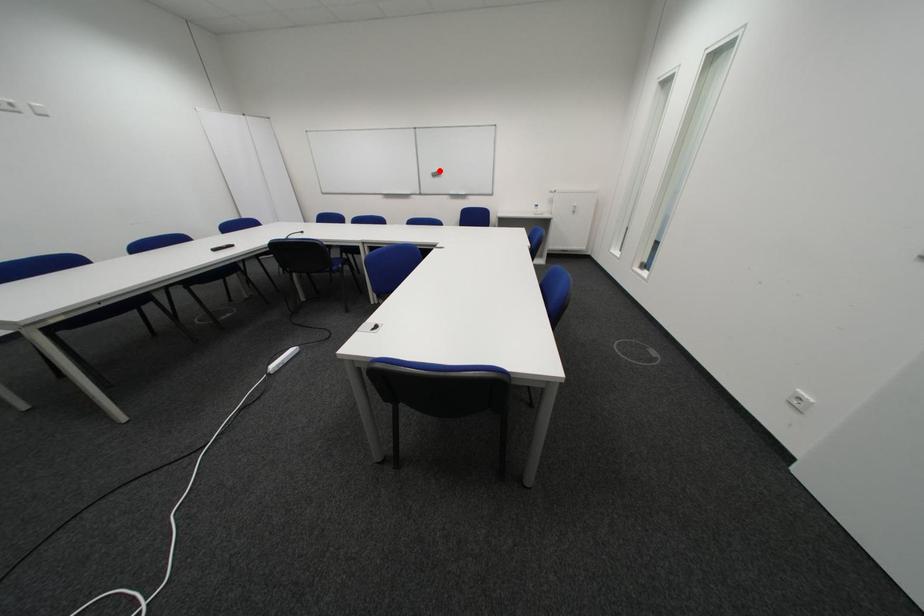
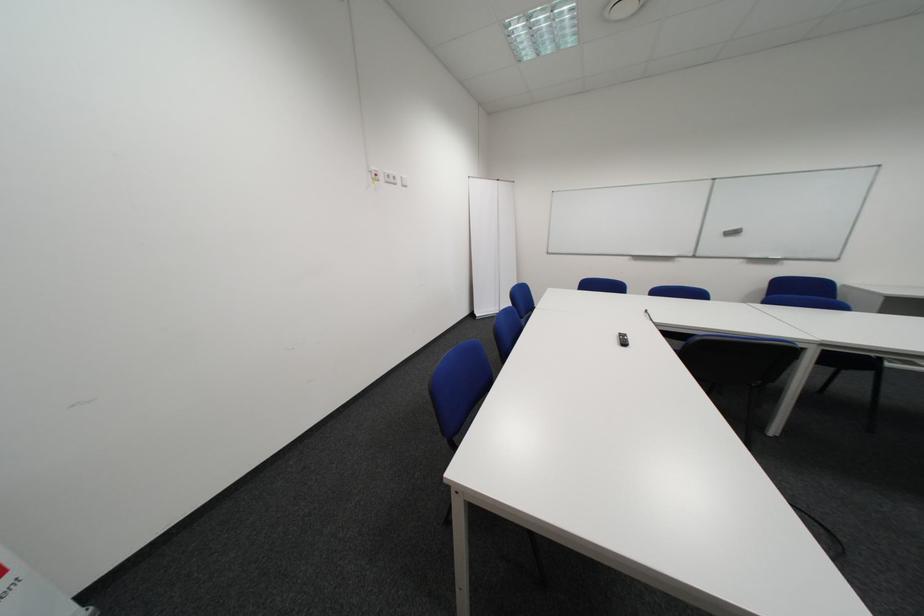
Locate, in the second image, the point that corresponds to the highlighted location in the first image.

(728, 228)